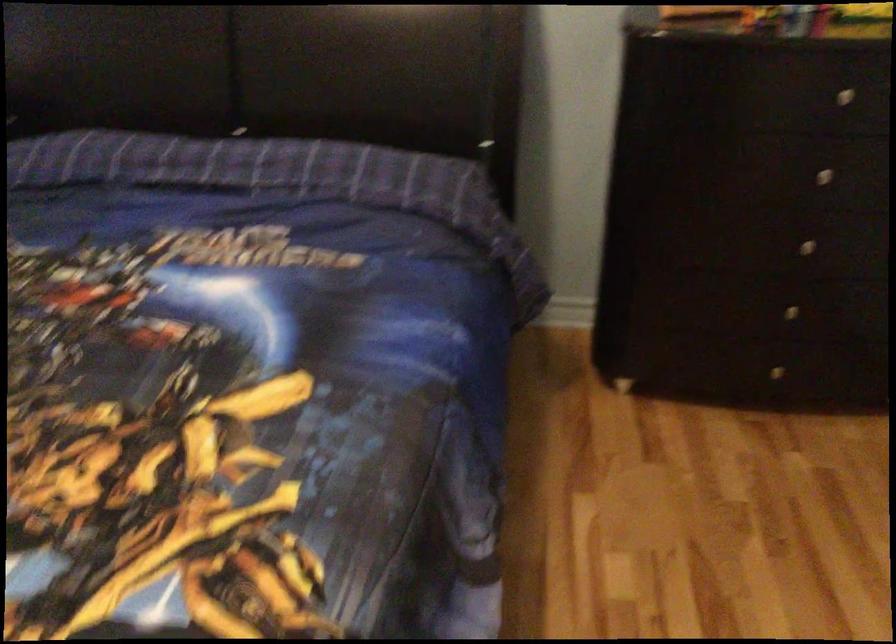
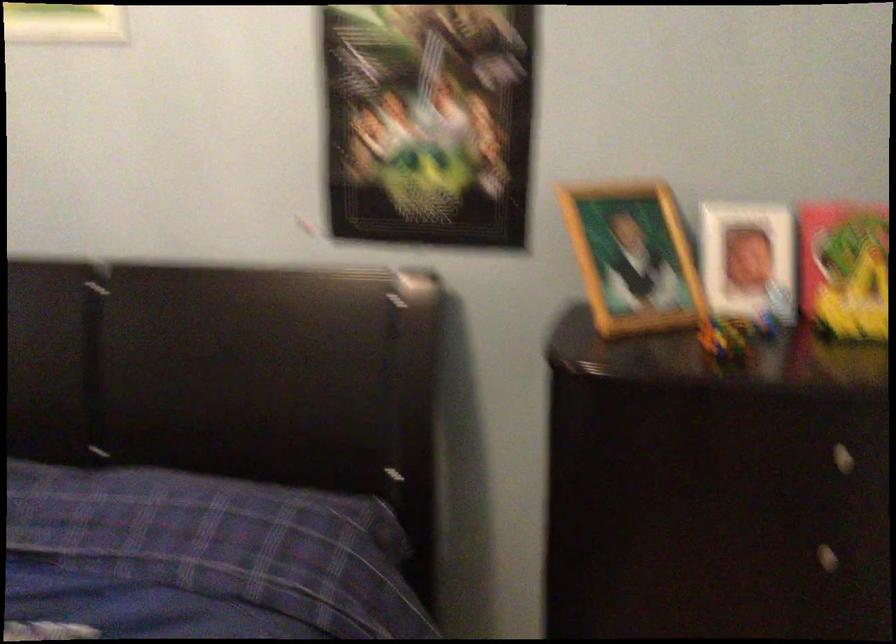
What movement of the cameraman would produce the second image?

The cameraman walked toward right, forward.